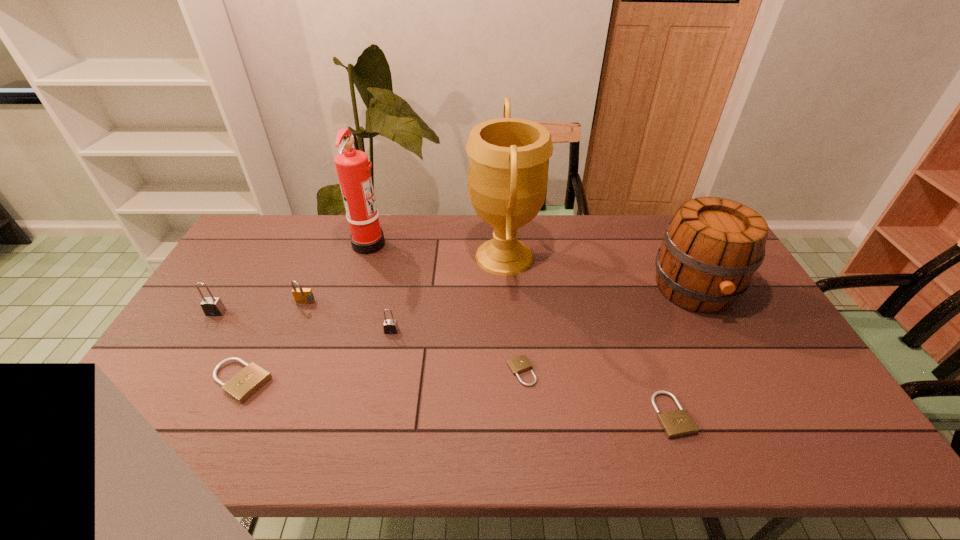
What are the coordinates of `vacant space situated 0.360m on the side of the cider where the spigot is located` in the screenshot? It's located at (773, 439).

Find the location of a particular element. The image size is (960, 540). free spot located on the shackle of the leftmost object is located at coordinates tap(172, 385).

Where is `vacant region located on the side with the combination dials of the farthest padlock`? The image size is (960, 540). vacant region located on the side with the combination dials of the farthest padlock is located at coordinates (265, 401).

Identify the location of free spot located 0.190m on the shackle of the sixth farthest object. The image size is (960, 540). (379, 392).

You are a GUI agent. You are given a task and a screenshot of the screen. Output one action in this format:
    pyautogui.click(x=<x>, y=<y>)
    Task: Click on the blank area located on the right of the leftmost beige padlock
    This screenshot has height=540, width=960.
    Given the screenshot: What is the action you would take?
    pyautogui.click(x=337, y=381)

The height and width of the screenshot is (540, 960). I want to click on free space located on the right of the second object from right to left, so click(x=735, y=415).

I want to click on vacant region located 0.150m on the right of the second beige padlock from right to left, so click(593, 372).

I want to click on trophy that is at the far edge, so click(507, 178).

The width and height of the screenshot is (960, 540). Find the location of `fire extinguisher that is at the far edge`. fire extinguisher that is at the far edge is located at coordinates click(352, 165).

Where is `object located in the near edge section of the desktop`? The height and width of the screenshot is (540, 960). object located in the near edge section of the desktop is located at coordinates (677, 423).